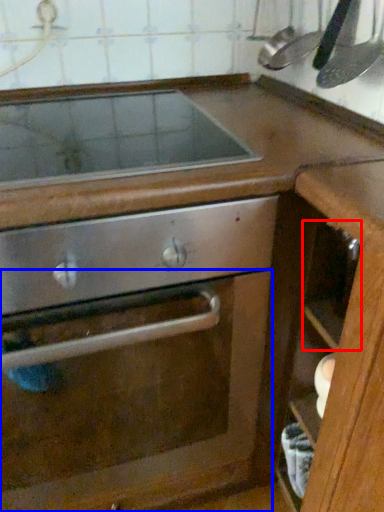
Question: Which object is closer to the camera taking this photo, drawer (highlighted by a red box) or glass door (highlighted by a blue box)?

Choices:
 (A) drawer
 (B) glass door

Answer: (B)